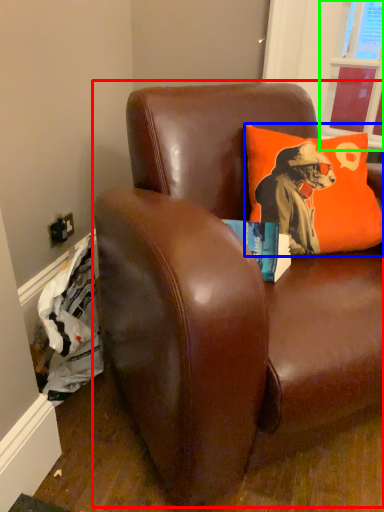
Question: Considering the real-world distances, which object is farthest from studio couch (highlighted by a red box)? pillow (highlighted by a blue box) or window screen (highlighted by a green box)?

Choices:
 (A) pillow
 (B) window screen

Answer: (B)